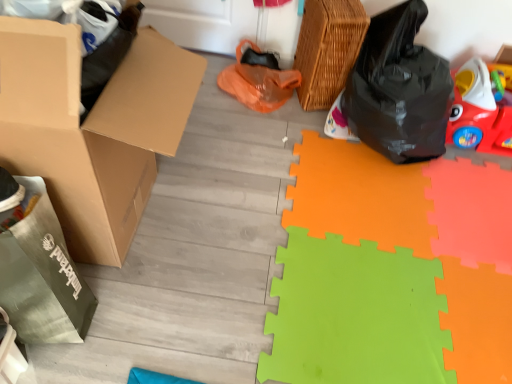
Question: Can you confirm if black plastic bag at right is wider than woven brown basket at upper right?

Choices:
 (A) no
 (B) yes

Answer: (B)

Question: Is the depth of black plastic bag at right greater than that of woven brown basket at upper right?

Choices:
 (A) no
 (B) yes

Answer: (A)

Question: Is black plastic bag at right shorter than woven brown basket at upper right?

Choices:
 (A) no
 (B) yes

Answer: (A)

Question: Can you confirm if black plastic bag at right is positioned to the right of woven brown basket at upper right?

Choices:
 (A) yes
 (B) no

Answer: (A)

Question: From a real-world perspective, is black plastic bag at right below woven brown basket at upper right?

Choices:
 (A) yes
 (B) no

Answer: (B)

Question: Does black plastic bag at right have a greater height compared to woven brown basket at upper right?

Choices:
 (A) yes
 (B) no

Answer: (A)

Question: Can you confirm if woven brown basket at upper right is bigger than green foam mat at lower right?

Choices:
 (A) no
 (B) yes

Answer: (A)

Question: From the image's perspective, does woven brown basket at upper right appear lower than green foam mat at lower right?

Choices:
 (A) yes
 (B) no

Answer: (B)

Question: Considering the relative sizes of woven brown basket at upper right and green foam mat at lower right in the image provided, is woven brown basket at upper right wider than green foam mat at lower right?

Choices:
 (A) yes
 (B) no

Answer: (B)

Question: Is woven brown basket at upper right not inside green foam mat at lower right?

Choices:
 (A) yes
 (B) no

Answer: (A)

Question: Can you confirm if woven brown basket at upper right is thinner than green foam mat at lower right?

Choices:
 (A) yes
 (B) no

Answer: (A)

Question: Can you confirm if woven brown basket at upper right is smaller than green foam mat at lower right?

Choices:
 (A) yes
 (B) no

Answer: (A)

Question: Is brown cardboard box at left completely or partially outside of green foam mat at lower right?

Choices:
 (A) no
 (B) yes

Answer: (B)